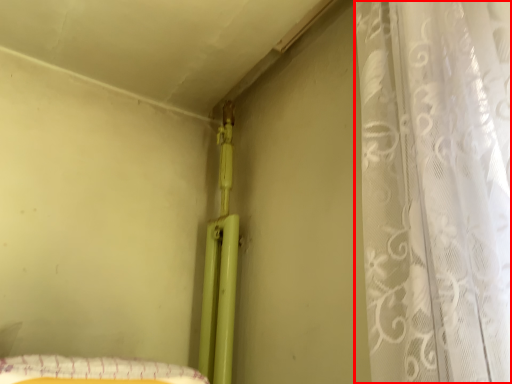
Question: From the image's perspective, where is curtain (annotated by the red box) located relative to sheet?

Choices:
 (A) below
 (B) above

Answer: (B)